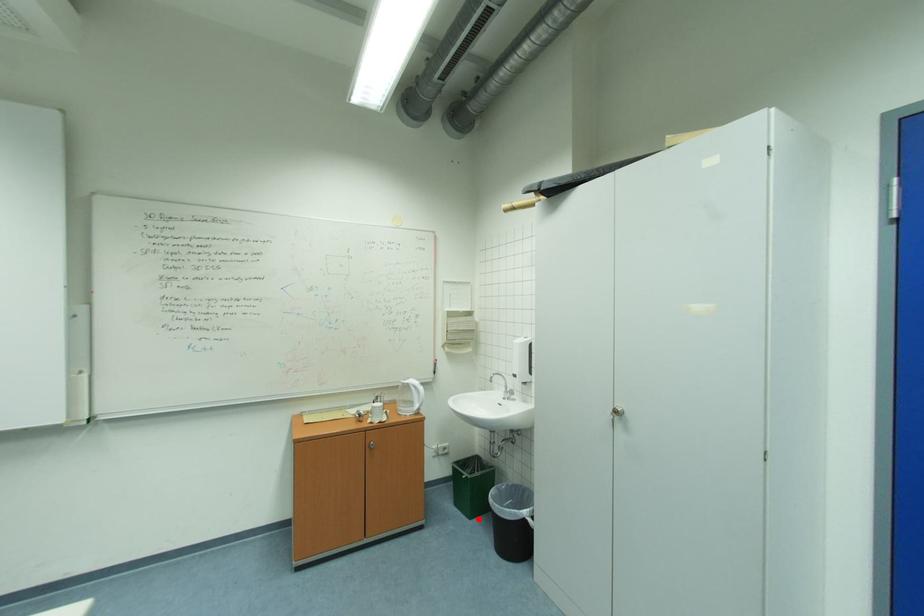
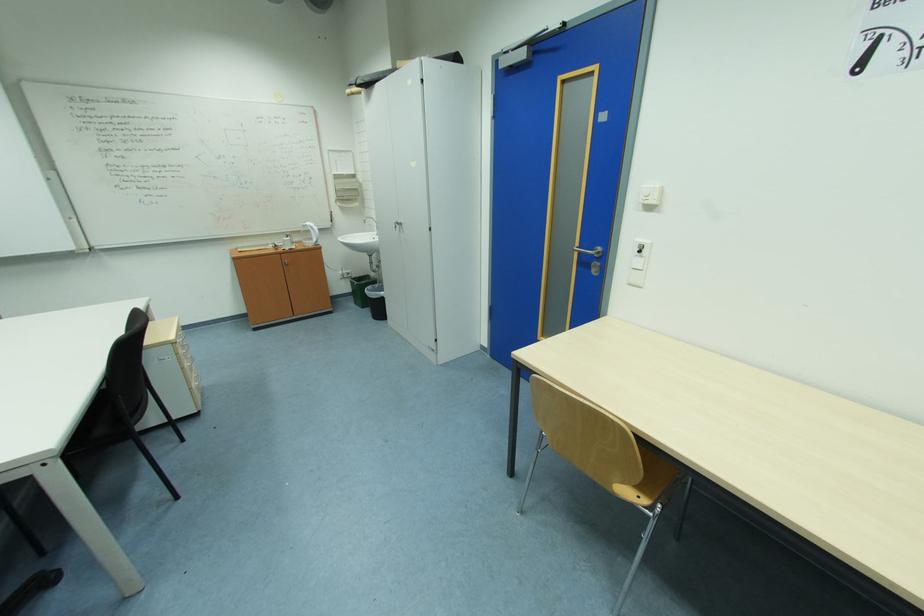
Where in the second image is the point corresponding to the highlighted location from the first image?

(370, 309)